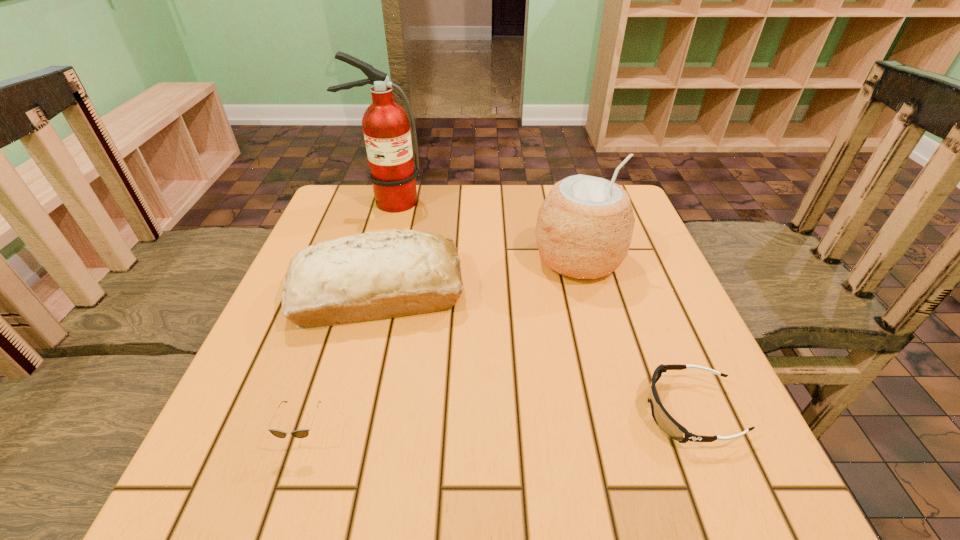
The image size is (960, 540). Find the location of `free spot between the second tallest object and the bread`. free spot between the second tallest object and the bread is located at coordinates (478, 276).

Find the location of `free spot between the sunglasses and the coconut`. free spot between the sunglasses and the coconut is located at coordinates (441, 347).

This screenshot has height=540, width=960. Identify the location of free space between the coconut and the third shortest object. (478, 276).

Identify the location of free space between the fourth shortest object and the third tallest object. (478, 276).

You are a GUI agent. You are given a task and a screenshot of the screen. Output one action in this format:
    pyautogui.click(x=<x>, y=<y>)
    Task: Click on the vacant point located between the shortest object and the fire extinguisher
    The width and height of the screenshot is (960, 540).
    Given the screenshot: What is the action you would take?
    pyautogui.click(x=539, y=306)

Where is `free space between the coconut and the shortest object`? free space between the coconut and the shortest object is located at coordinates (635, 335).

Where is `vacant area between the fourth tallest object and the fourth shortest object`? The width and height of the screenshot is (960, 540). vacant area between the fourth tallest object and the fourth shortest object is located at coordinates (441, 347).

This screenshot has width=960, height=540. Find the location of `empty space that is in between the shortest object and the coconut`. empty space that is in between the shortest object and the coconut is located at coordinates (635, 335).

Find the location of a particular element. The height and width of the screenshot is (540, 960). free area in between the third tallest object and the coconut is located at coordinates click(x=478, y=276).

Choose which object is the third nearest neighbor to the third tallest object. Please provide its 2D coordinates. Your answer should be formatted as a tuple, i.e. [(x, y)], where the tuple contains the x and y coordinates of a point satisfying the conditions above.

[(386, 126)]